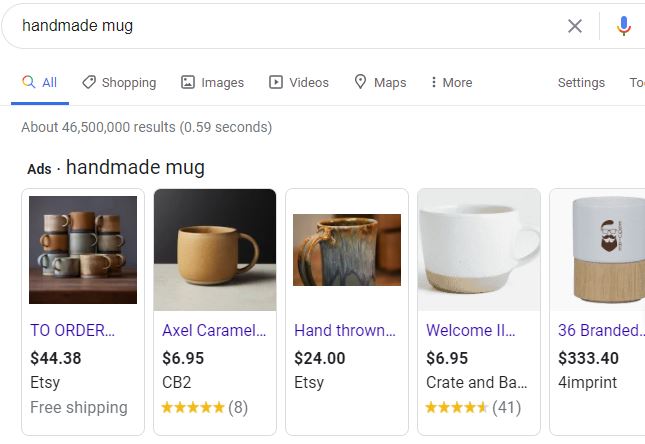
The height and width of the screenshot is (444, 645). Identify the location of counter. (384, 275), (255, 292), (110, 281).